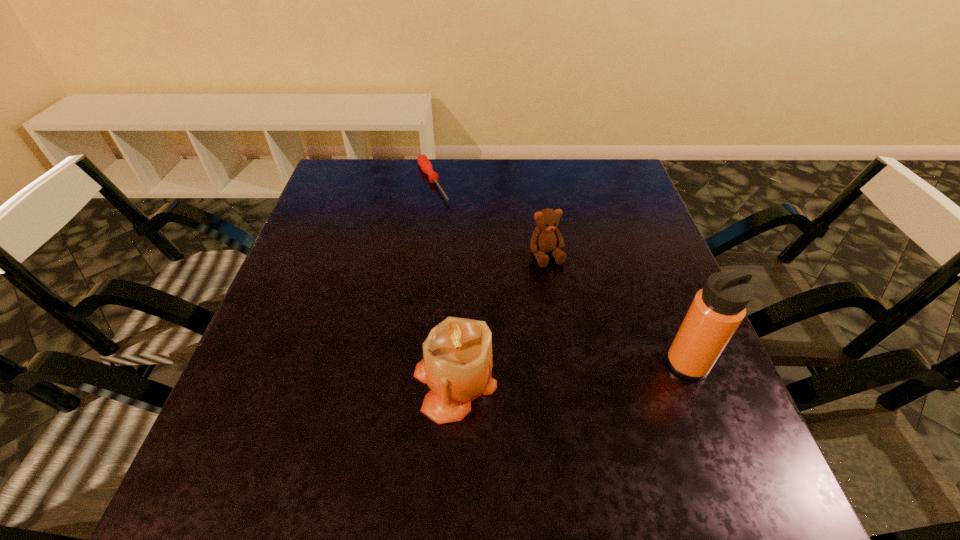
Locate an element on the screen. free spot located 0.200m at the tip of the shortest object is located at coordinates (465, 246).

Identify the location of free spot located at the tip of the shortest object. (474, 261).

Locate an element on the screen. This screenshot has height=540, width=960. free space located 0.400m on the face of the third object from left to right is located at coordinates (631, 427).

Locate an element on the screen. This screenshot has height=540, width=960. blank space located 0.390m on the face of the third object from left to right is located at coordinates (628, 421).

This screenshot has width=960, height=540. Find the location of `free spot located on the face of the third object from left to right`. free spot located on the face of the third object from left to right is located at coordinates (567, 300).

Where is `object that is at the far edge`? The image size is (960, 540). object that is at the far edge is located at coordinates (424, 163).

At what (x,y) coordinates should I click in order to perform the action: click on object at the near edge. Please return your answer as a coordinate pair (x, y). The height and width of the screenshot is (540, 960). Looking at the image, I should click on (457, 364).

At what (x,y) coordinates should I click in order to perform the action: click on object that is positioned at the right edge. Please return your answer as a coordinate pair (x, y). The image size is (960, 540). Looking at the image, I should click on (717, 310).

Locate an element on the screen. Image resolution: width=960 pixels, height=540 pixels. vacant space at the far edge of the desktop is located at coordinates click(x=558, y=178).

In the image, there is a desktop. Identify the location of vacant space at the near edge. (554, 404).